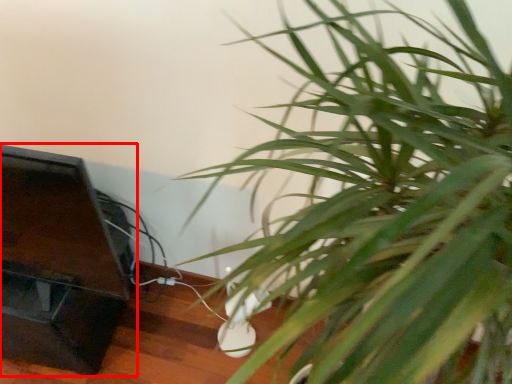
Question: From the image's perspective, where is furniture (annotated by the red box) located in relation to houseplant in the image?

Choices:
 (A) below
 (B) above

Answer: (A)